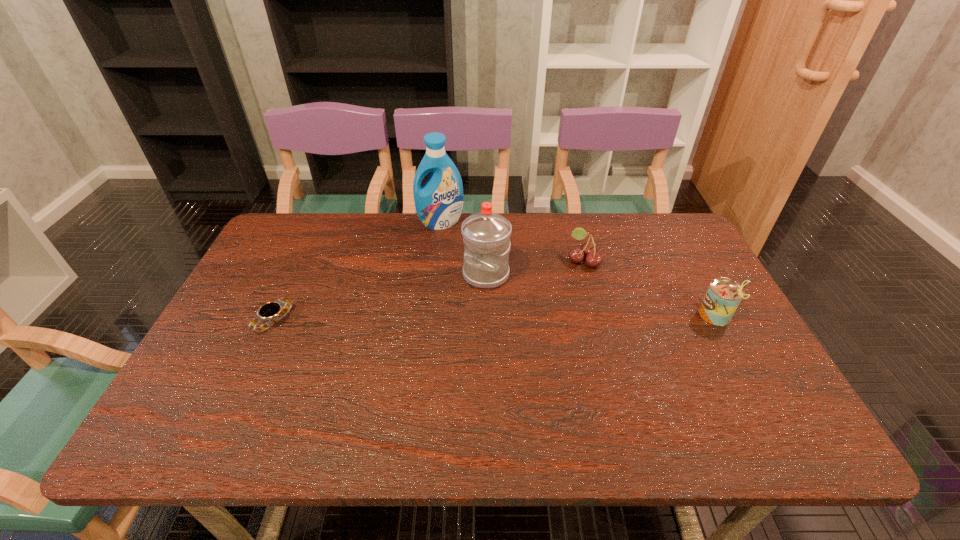
Where is `vacant space situated 0.290m on the right of the watch`? This screenshot has height=540, width=960. vacant space situated 0.290m on the right of the watch is located at coordinates (401, 321).

What are the coordinates of `vacant area situated 0.210m on the back of the rightmost object` in the screenshot? It's located at (683, 253).

Identify the location of free space located on the front-facing side of the farthest object. (445, 239).

Identify the location of vacant space positioned on the front-facing side of the farthest object. (457, 294).

Locate an element on the screen. This screenshot has height=540, width=960. vacant space located 0.340m on the front-facing side of the farthest object is located at coordinates (459, 302).

Where is `vacant space located on the leaves of the fourth tallest object`? Image resolution: width=960 pixels, height=540 pixels. vacant space located on the leaves of the fourth tallest object is located at coordinates (477, 319).

Where is `vacant space located 0.240m on the leaves of the fourth tallest object`? vacant space located 0.240m on the leaves of the fourth tallest object is located at coordinates click(x=510, y=301).

Find the location of `vacant space located on the leaves of the fourth tallest object`. vacant space located on the leaves of the fourth tallest object is located at coordinates (542, 283).

You are a GUI agent. You are given a task and a screenshot of the screen. Output one action in this format:
    pyautogui.click(x=<x>, y=<y>)
    Task: Click on the vacant area situated 0.110m on the handle side of the third object from left to right
    The height and width of the screenshot is (540, 960).
    Given the screenshot: What is the action you would take?
    pyautogui.click(x=450, y=312)

This screenshot has width=960, height=540. In order to click on free space located on the handle side of the third object from left to right in this screenshot , I will do `click(396, 369)`.